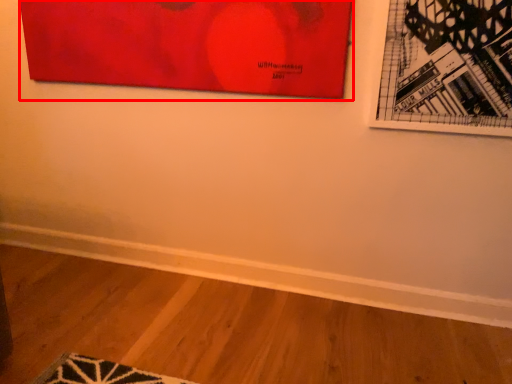
Question: Where is picture frame (annotated by the red box) located in relation to picture frame in the image?

Choices:
 (A) left
 (B) right

Answer: (A)